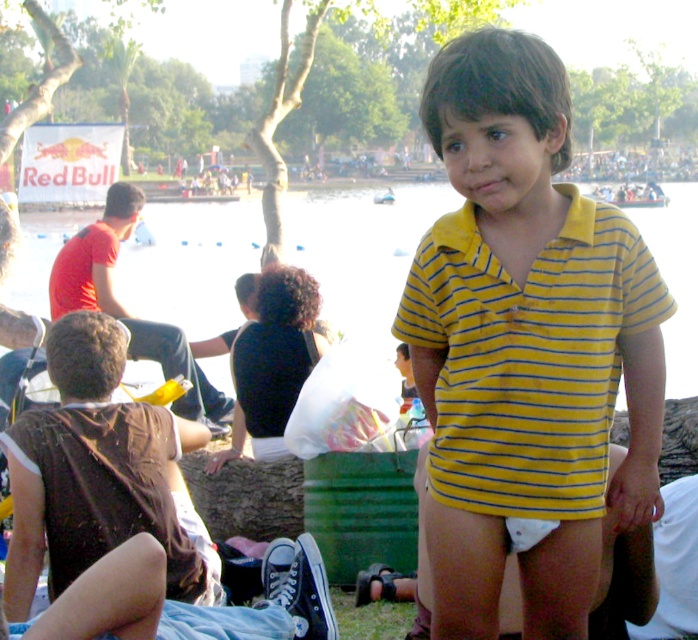
Question: Does yellow striped shirt at center lie behind transparent plastic water at center?

Choices:
 (A) yes
 (B) no

Answer: (B)

Question: Which point is farther to the camera?

Choices:
 (A) (387, 220)
 (B) (533, 253)

Answer: (A)

Question: Where is yellow striped shirt at center located in relation to transparent plastic water at center in the image?

Choices:
 (A) right
 (B) left

Answer: (A)

Question: Among these objects, which one is farthest from the camera?

Choices:
 (A) transparent plastic water at center
 (B) yellow striped shirt at center

Answer: (A)

Question: Considering the relative positions of yellow striped shirt at center and transparent plastic water at center in the image provided, where is yellow striped shirt at center located with respect to transparent plastic water at center?

Choices:
 (A) left
 (B) right

Answer: (B)